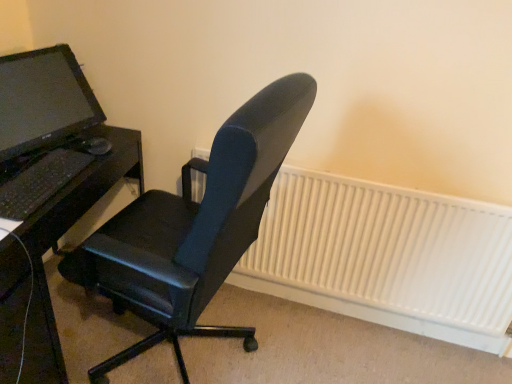
Image resolution: width=512 pixels, height=384 pixels. What do you see at coordinates (193, 228) in the screenshot?
I see `black leather office chair at center` at bounding box center [193, 228].

Where is `white matte radiator at center`? This screenshot has height=384, width=512. white matte radiator at center is located at coordinates (387, 251).

This screenshot has height=384, width=512. Identify the location of black leather office chair at center. (193, 228).

The height and width of the screenshot is (384, 512). I want to click on mouse located above the black matte keyboard at left (from a real-world perspective), so click(95, 146).

Can you tell me how much black matte keyboard at left and black plastic mouse at center differ in facing direction?

The angle between the facing direction of black matte keyboard at left and the facing direction of black plastic mouse at center is 0.00256 degrees.

Is black matte keyboard at left wider than black plastic mouse at center?

Correct, the width of black matte keyboard at left exceeds that of black plastic mouse at center.

Is point (69, 57) positioned behind point (0, 266)?

Yes.

From the image's perspective, which one is positioned lower, matte black monitor at left or black matte desk at left?

black matte desk at left, from the image's perspective.

Considering the sizes of objects matte black monitor at left and black matte desk at left in the image provided, who is shorter, matte black monitor at left or black matte desk at left?

matte black monitor at left is shorter.

Considering the sizes of black matte desk at left and black plastic mouse at center in the image, is black matte desk at left wider or thinner than black plastic mouse at center?

Clearly, black matte desk at left has more width compared to black plastic mouse at center.

From a real-world perspective, is black matte desk at left above or below black plastic mouse at center?

Clearly, from a real-world perspective, black matte desk at left is below black plastic mouse at center.

Which is more to the right, black matte desk at left or black plastic mouse at center?

From the viewer's perspective, black plastic mouse at center appears more on the right side.

Considering the positions of objects black matte keyboard at left and black matte desk at left in the image provided, who is more to the right, black matte keyboard at left or black matte desk at left?

Positioned to the right is black matte keyboard at left.

Would you say black matte keyboard at left is inside or outside black matte desk at left?

black matte keyboard at left is not enclosed by black matte desk at left.

Which object is closer to the camera taking this photo, black matte keyboard at left or black matte desk at left?

black matte desk at left.

I want to click on desk below the black matte keyboard at left (from the image's perspective), so click(x=66, y=231).

From a real-world perspective, is black plastic mouse at center on top of white matte radiator at center?

Yes.

How different are the orientations of black plastic mouse at center and white matte radiator at center in degrees?

The angle between the facing direction of black plastic mouse at center and the facing direction of white matte radiator at center is 95.4 degrees.

Could you tell me if black plastic mouse at center is facing white matte radiator at center?

No.

Considering the relative positions of black plastic mouse at center and white matte radiator at center in the image provided, is black plastic mouse at center to the right of white matte radiator at center from the viewer's perspective?

Incorrect, black plastic mouse at center is not on the right side of white matte radiator at center.

Which is correct: white matte radiator at center is inside black matte keyboard at left, or outside of it?

white matte radiator at center cannot be found inside black matte keyboard at left.

You are a GUI agent. You are given a task and a screenshot of the screen. Output one action in this format:
    pyautogui.click(x=<x>, y=<y>)
    Task: Click on the computer keyboard above the white matte radiator at center (from a real-world perspective)
    
    Given the screenshot: What is the action you would take?
    pyautogui.click(x=40, y=182)

Does white matte radiator at center come behind black matte keyboard at left?

Yes, white matte radiator at center is behind black matte keyboard at left.

From a real-world perspective, which object stands above the other?

black plastic mouse at center is physically above.

Would you say black leather office chair at center is part of black plastic mouse at center's contents?

No, black leather office chair at center is not a part of black plastic mouse at center.

Could you tell me if black plastic mouse at center is turned towards black leather office chair at center?

Yes.

Looking at this image, can you tell me how much black plastic mouse at center and black leather office chair at center differ in facing direction?

The facing directions of black plastic mouse at center and black leather office chair at center are 169 degrees apart.

Locate an element on the screen. The image size is (512, 384). mouse located above the black matte keyboard at left (from the image's perspective) is located at coordinates (95, 146).

The width and height of the screenshot is (512, 384). In order to click on computer monitor on the right of black matte desk at left in this screenshot , I will do `click(42, 100)`.

Looking at the image, which one is located further to white matte radiator at center, black plastic mouse at center or black leather office chair at center?

black plastic mouse at center is further to white matte radiator at center.

Estimate the real-world distances between objects in this image. Which object is further from white matte radiator at center, matte black monitor at left or black matte desk at left?

The object further to white matte radiator at center is matte black monitor at left.

Based on their spatial positions, is black matte desk at left or matte black monitor at left further from white matte radiator at center?

matte black monitor at left.

Which object lies nearer to the anchor point white matte radiator at center, matte black monitor at left or black leather office chair at center?

The object closer to white matte radiator at center is black leather office chair at center.

Based on their spatial positions, is black matte keyboard at left or black leather office chair at center closer to white matte radiator at center?

black leather office chair at center.

Which object lies further to the anchor point black matte desk at left, matte black monitor at left or black matte keyboard at left?

Among the two, matte black monitor at left is located further to black matte desk at left.

Estimate the real-world distances between objects in this image. Which object is closer to black matte keyboard at left, black leather office chair at center or black matte desk at left?

black matte desk at left.

Based on the photo, which object lies nearer to the anchor point black matte desk at left, matte black monitor at left or white matte radiator at center?

Among the two, matte black monitor at left is located nearer to black matte desk at left.

Locate an element on the screen. computer chair between black plastic mouse at center and white matte radiator at center from left to right is located at coordinates (193, 228).

Where is `mouse between matte black monitor at left and white matte radiator at center from left to right`? This screenshot has height=384, width=512. mouse between matte black monitor at left and white matte radiator at center from left to right is located at coordinates (95, 146).

Identify the location of computer keyboard between black matte desk at left and black plastic mouse at center along the z-axis. (40, 182).

Where is `computer keyboard between black matte desk at left and white matte radiator at center from left to right`? The height and width of the screenshot is (384, 512). computer keyboard between black matte desk at left and white matte radiator at center from left to right is located at coordinates (40, 182).